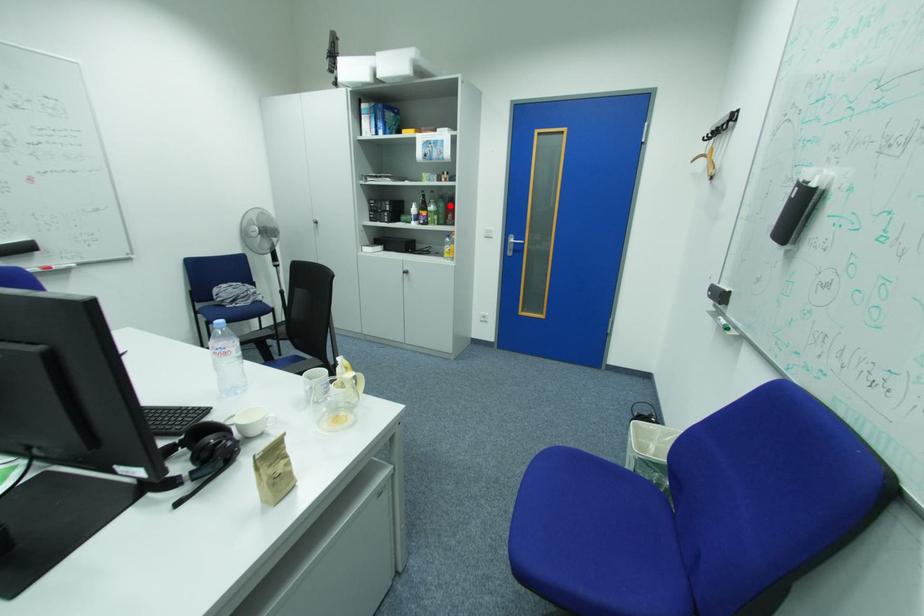
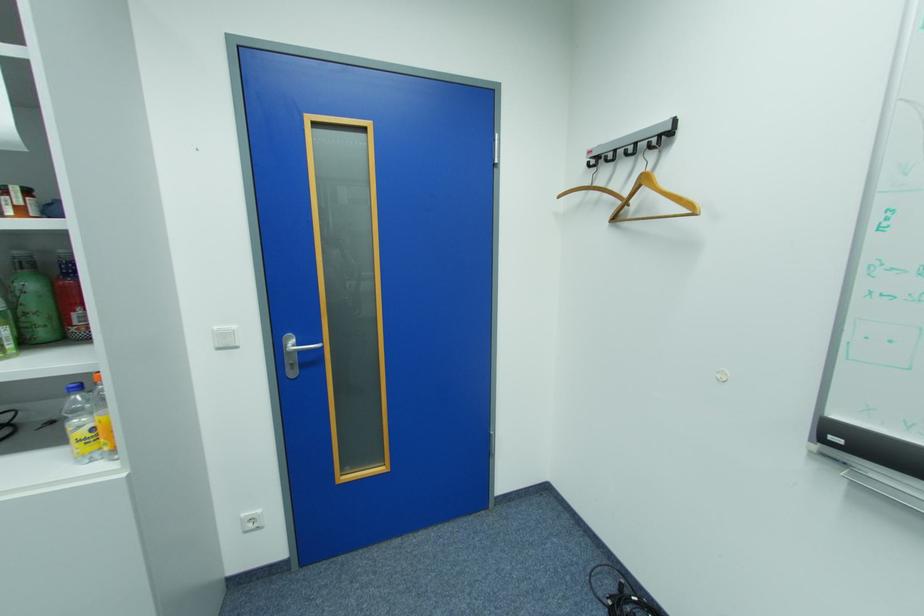
Where in the second image is the point corresponding to the highlighted location from the first image?

(41, 286)